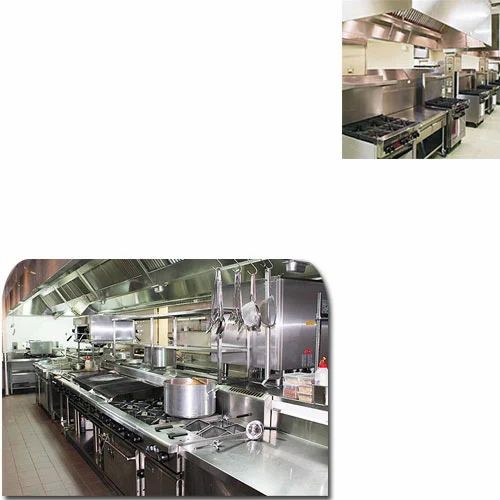
What are the coordinates of `oven handles` in the screenshot? It's located at (158, 468), (117, 451), (406, 152), (436, 122).